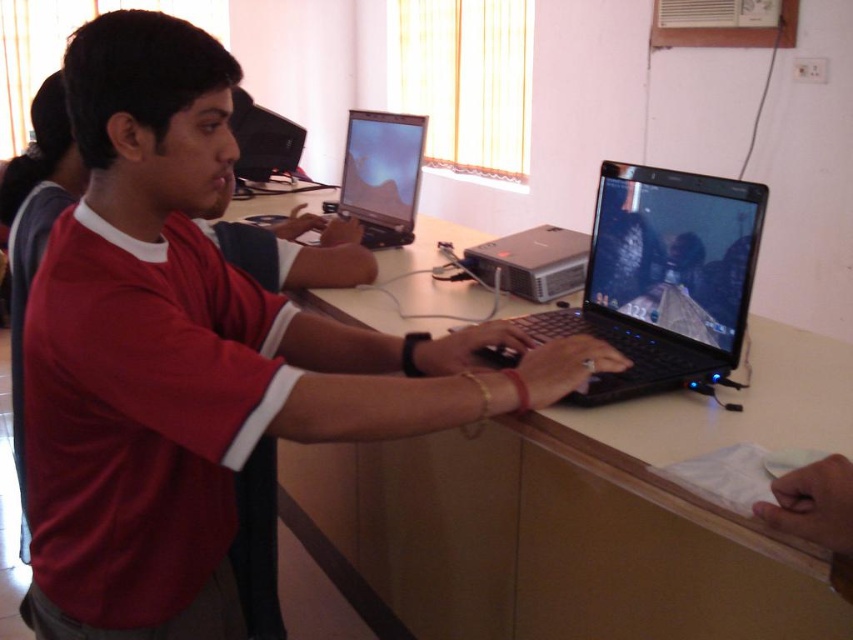
You are a student in the classroom and need to reach the shiny black laptop at center. You are currently standing at the projector. Which direction should you move to reach it?

The shiny black laptop at center is located at point (381,176), so you should move towards the desk where the laptop is placed, which is to your left from the projector.

You are a student in the classroom and need to place both the black glossy laptop at center and the shiny black laptop at center on a desk that can only hold one of them. Which laptop should you choose to fit on the desk?

The black glossy laptop at center occupies less space than the shiny black laptop at center, so you should choose the black glossy laptop at center to fit on the desk.

You are a student in the classroom and want to reach the black plastic computer at center without moving the shiny black laptop at center. Is it possible to do so?

The shiny black laptop at center is closer to you than the black plastic computer at center, so you can reach the black plastic computer at center by moving around the laptop or accessing it from the side without disturbing it.